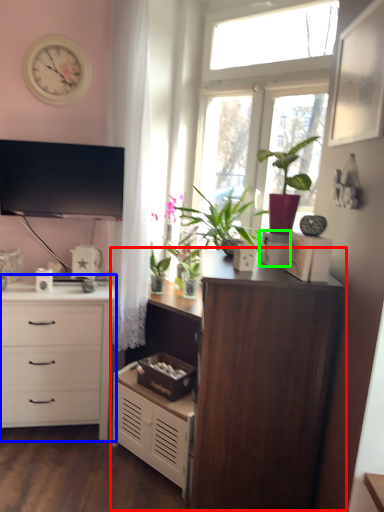
Question: Which is nearer to the cupboard (highlighted by a red box)? chest of drawers (highlighted by a blue box) or storage box (highlighted by a green box).

Choices:
 (A) chest of drawers
 (B) storage box

Answer: (B)